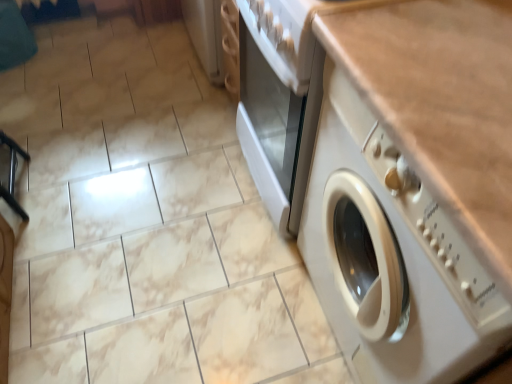
This screenshot has height=384, width=512. Describe the element at coordinates (291, 33) in the screenshot. I see `white glossy gas stove at upper center` at that location.

What is the approximate width of white glossy gas stove at upper center?

The width of white glossy gas stove at upper center is 18.53 inches.

You are a GUI agent. You are given a task and a screenshot of the screen. Output one action in this format:
    pyautogui.click(x=<x>, y=<y>)
    Task: Click on the white glossy gas stove at upper center
    
    Given the screenshot: What is the action you would take?
    pyautogui.click(x=291, y=33)

Image resolution: width=512 pixels, height=384 pixels. What do you see at coordinates (391, 256) in the screenshot? I see `white plastic washing machine at center` at bounding box center [391, 256].

Image resolution: width=512 pixels, height=384 pixels. Find the location of `white plastic washing machine at center`. white plastic washing machine at center is located at coordinates (391, 256).

This screenshot has width=512, height=384. What are the coordinates of `white glossy gas stove at upper center` in the screenshot? It's located at (291, 33).

Is white plastic washing machine at center to the left of white glossy gas stove at upper center from the viewer's perspective?

In fact, white plastic washing machine at center is to the right of white glossy gas stove at upper center.

Is white plastic washing machine at center in front of or behind white glossy gas stove at upper center in the image?

Clearly, white plastic washing machine at center is in front of white glossy gas stove at upper center.

Considering the positions of points (432, 325) and (304, 9), is point (432, 325) farther from camera compared to point (304, 9)?

No.

Consider the image. From the image's perspective, which object appears higher, white plastic washing machine at center or white glossy gas stove at upper center?

white glossy gas stove at upper center, from the image's perspective.

From a real-world perspective, is white plastic washing machine at center above or below white glossy gas stove at upper center?

white plastic washing machine at center is below white glossy gas stove at upper center.

Does white plastic washing machine at center have a greater width compared to white glossy gas stove at upper center?

Yes, white plastic washing machine at center is wider than white glossy gas stove at upper center.

Who is shorter, white plastic washing machine at center or white glossy gas stove at upper center?

Standing shorter between the two is white glossy gas stove at upper center.

Is white plastic washing machine at center smaller than white glossy gas stove at upper center?

Actually, white plastic washing machine at center might be larger than white glossy gas stove at upper center.

Is white plastic washing machine at center outside of white glossy gas stove at upper center?

white plastic washing machine at center lies outside white glossy gas stove at upper center's area.

Is white plastic washing machine at center directly adjacent to white glossy gas stove at upper center?

No.

Is white plastic washing machine at center facing away from white glossy gas stove at upper center?

white plastic washing machine at center does not have its back to white glossy gas stove at upper center.

Where is `gas stove that is on the left side of white plastic washing machine at center`? The image size is (512, 384). gas stove that is on the left side of white plastic washing machine at center is located at coordinates (291, 33).

Is white glossy gas stove at upper center at the right side of white plastic washing machine at center?

No.

Is white glossy gas stove at upper center further to the viewer compared to white plastic washing machine at center?

Yes, white glossy gas stove at upper center is further from the viewer.

Which point is more forward, [286,39] or [331,125]?

The point [286,39] is closer to the camera.

From the image's perspective, which one is positioned lower, white glossy gas stove at upper center or white plastic washing machine at center?

white plastic washing machine at center is shown below in the image.

From a real-world perspective, which is physically above, white glossy gas stove at upper center or white plastic washing machine at center?

white glossy gas stove at upper center.

Considering the relative sizes of white glossy gas stove at upper center and white plastic washing machine at center in the image provided, is white glossy gas stove at upper center thinner than white plastic washing machine at center?

Yes.

Considering the sizes of white glossy gas stove at upper center and white plastic washing machine at center in the image, is white glossy gas stove at upper center taller or shorter than white plastic washing machine at center?

Considering their sizes, white glossy gas stove at upper center has less height than white plastic washing machine at center.

Which of these two, white glossy gas stove at upper center or white plastic washing machine at center, is bigger?

With larger size is white plastic washing machine at center.

Is white plastic washing machine at center inside white glossy gas stove at upper center?

No.

Would you consider white glossy gas stove at upper center to be distant from white plastic washing machine at center?

No, white glossy gas stove at upper center is not far from white plastic washing machine at center.

Is white glossy gas stove at upper center aimed at white plastic washing machine at center?

No, white glossy gas stove at upper center does not turn towards white plastic washing machine at center.

How many degrees apart are the facing directions of white glossy gas stove at upper center and white plastic washing machine at center?

0.3 degrees.

What are the coordinates of `washing machine below the white glossy gas stove at upper center (from a real-world perspective)` in the screenshot? It's located at (391, 256).

Identify the location of washing machine located below the white glossy gas stove at upper center (from the image's perspective). The height and width of the screenshot is (384, 512). click(391, 256).

Where is `gas stove above the white plastic washing machine at center (from a real-world perspective)`? gas stove above the white plastic washing machine at center (from a real-world perspective) is located at coordinates (291, 33).